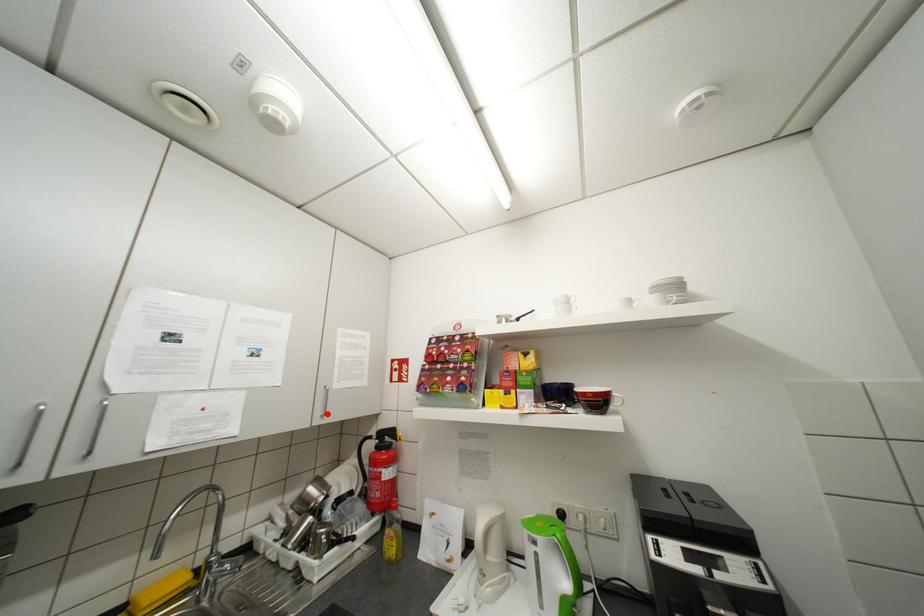
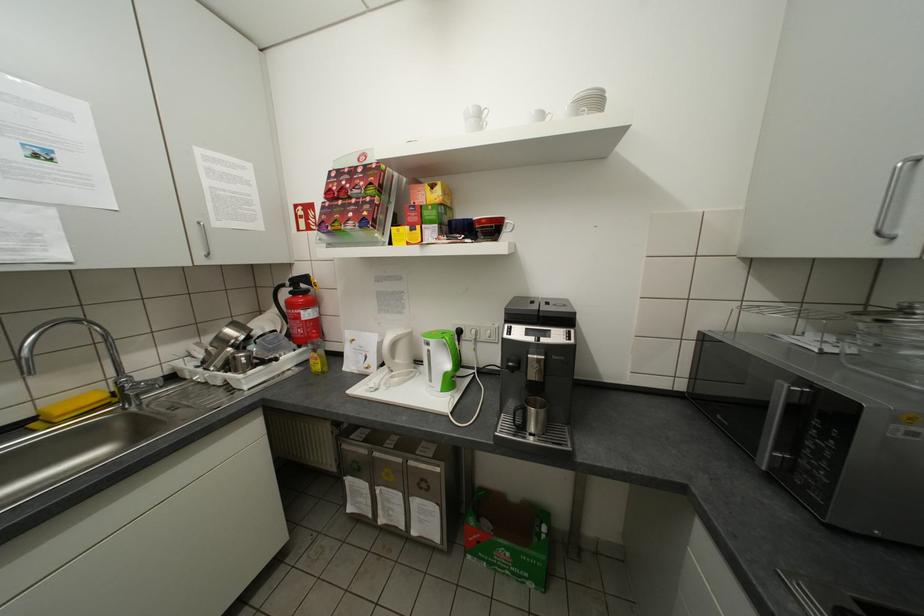
Question: I am providing you with two images of the same scene from different viewpoints. In image1, a red point is highlighted. Considering the same 3D point in image2, which of the following is correct?

Choices:
 (A) It is closer
 (B) It is farther

Answer: (A)